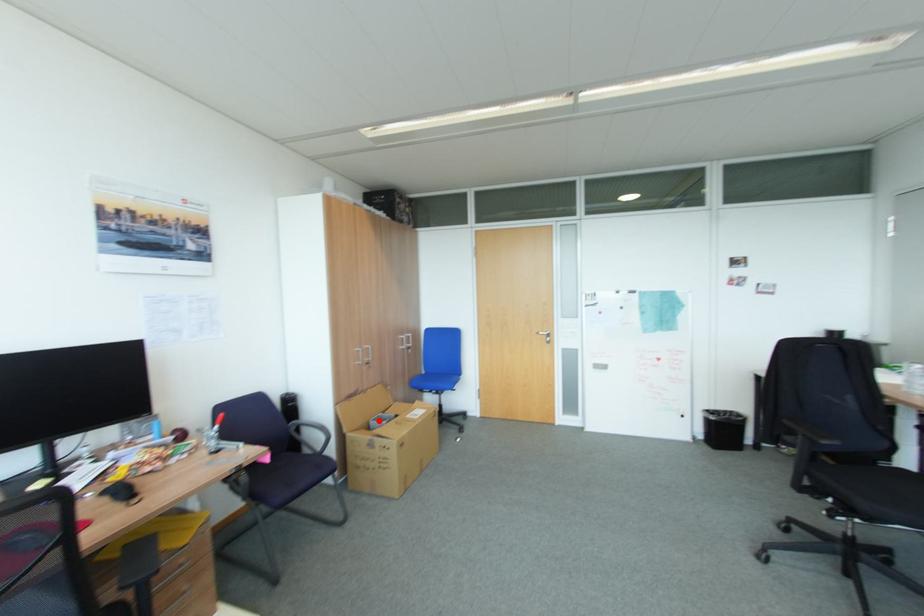
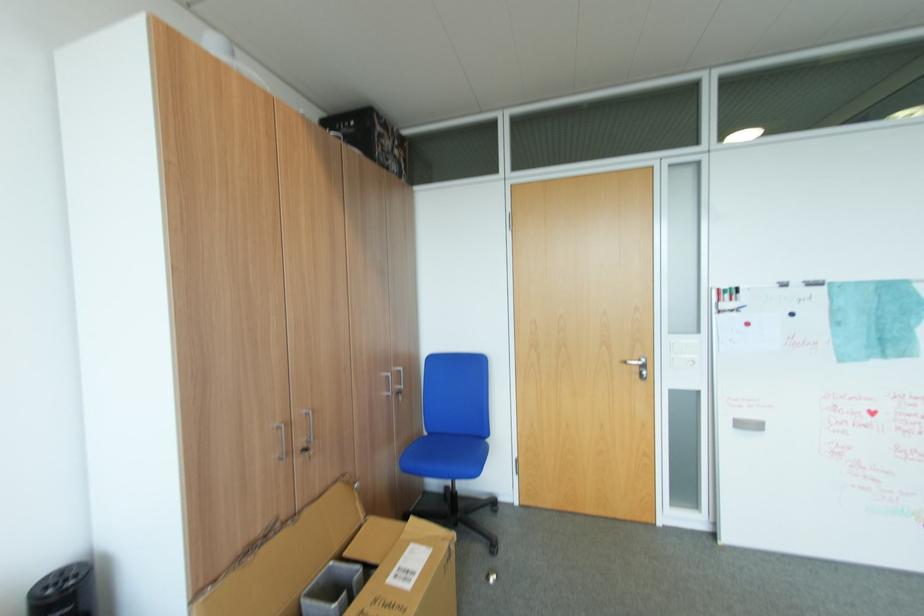
Find the pixel in the second image that matches the highlighted location in the first image.

(317, 593)